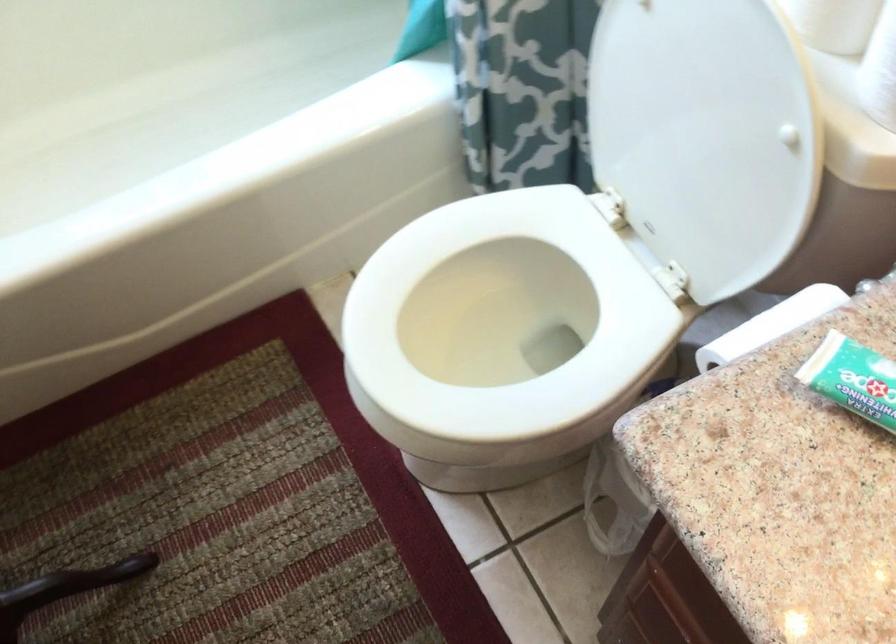
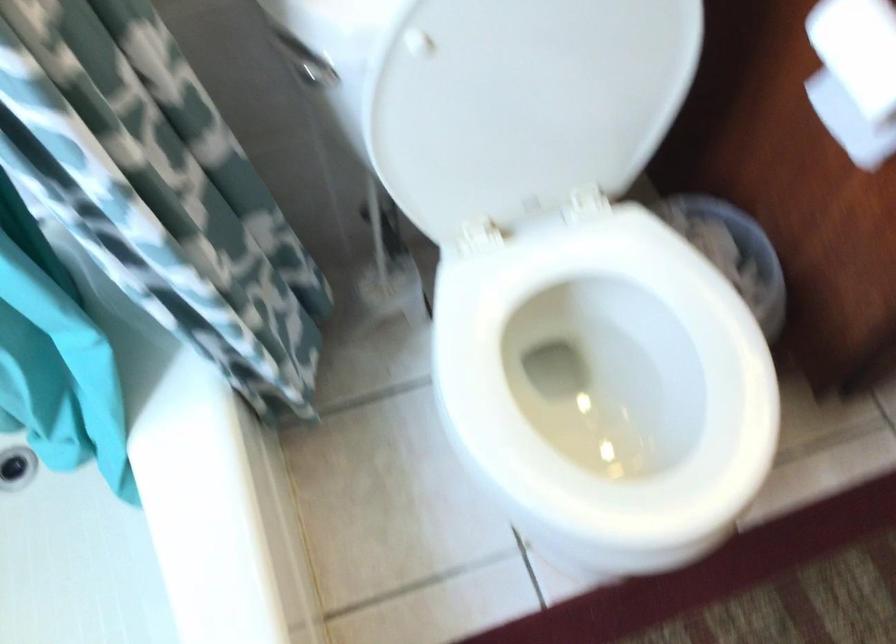
Find the pixel in the second image that matches point 752,335 in the first image.

(855, 76)